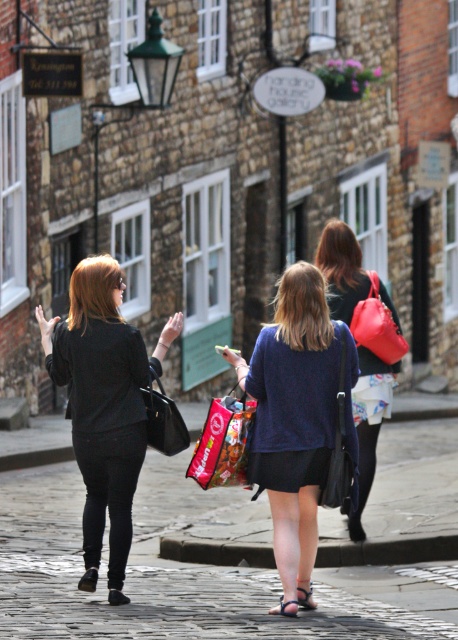
You are a delivery person carrying a large package that is 1.2 meters in length. You need to place it on the cobblestone pavement at center or the red plastic shopping bag at center. Which surface can accommodate the package without it hanging off the edge?

The cobblestone pavement at center has a larger size compared to the red plastic shopping bag at center, so the package should be placed on the cobblestone pavement at center to ensure it fits without overhanging.

You are standing on the cobblestone pavement at center and want to pick up the matte black handbag at center. Can you reach it without moving your feet?

The cobblestone pavement at center is closer to the viewer than the matte black handbag at center, so you cannot reach it without moving your feet because the handbag is further away.